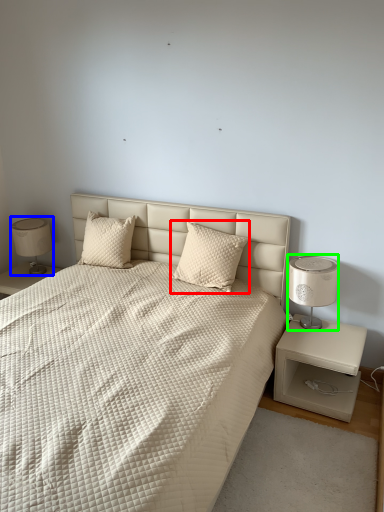
Question: Which object is positioned farthest from pillow (highlighted by a red box)? Select from table lamp (highlighted by a blue box) and bedside lamp (highlighted by a green box).

Choices:
 (A) table lamp
 (B) bedside lamp

Answer: (A)